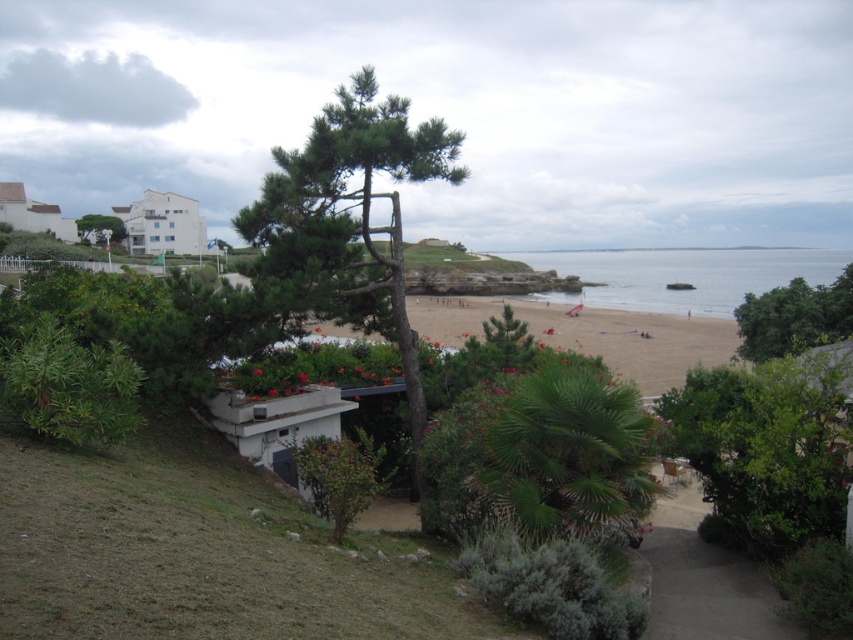
You are planning to set up a picnic blanket on the beach. The picnic blanket is 3 meters wide. You see the green textured tree at center and the clear blue water at center. Which area between the two would be more suitable for placing the blanket without it being too cramped? Explain your reasoning based on their widths.

The clear blue water at center has a greater width than the green textured tree at center. Since the picnic blanket is 3 meters wide, placing it near the area of the clear blue water at center would provide more space and avoid being cramped compared to the narrower area near the green textured tree at center.

Consider the image. You are a photographer who wants to capture the clear blue water at center in your shot. However, the green textured tree at center is blocking your view. Can you move the tree to the side to get a clear shot of the water?

The green textured tree at center is not as tall as clear blue water at center, so moving the tree to the side would allow you to capture the clear blue water at center without obstruction.